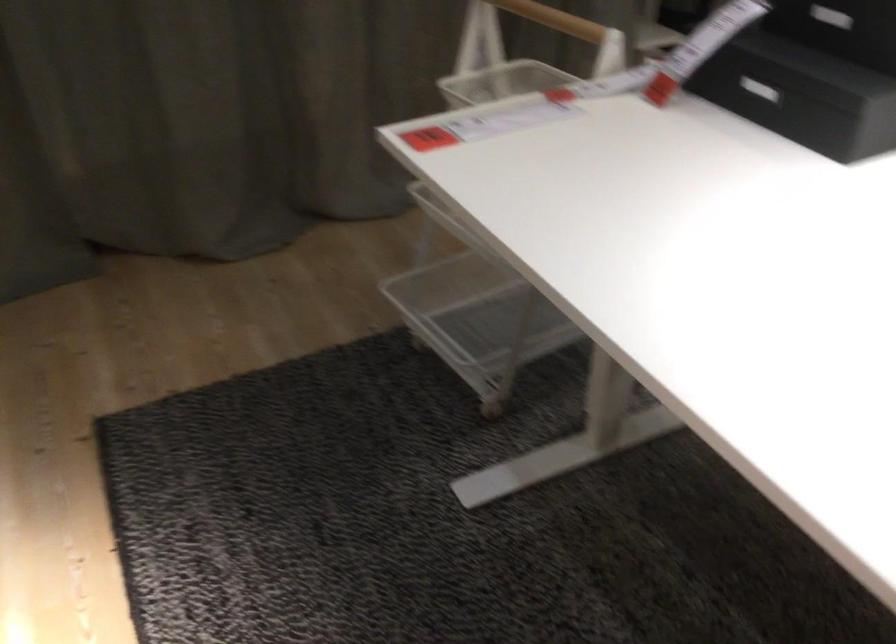
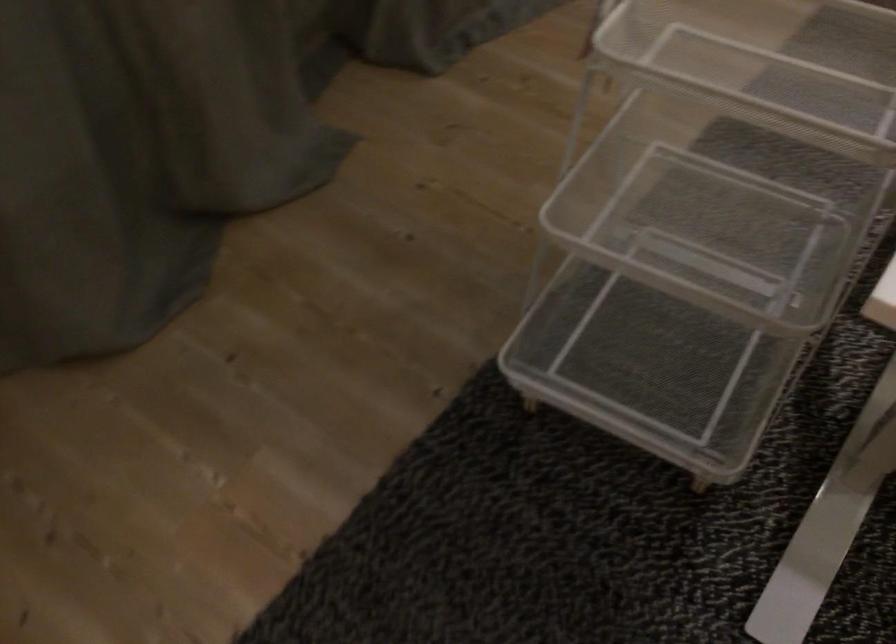
Which direction would the cameraman need to move to produce the second image?

The cameraman moved toward left, forward.